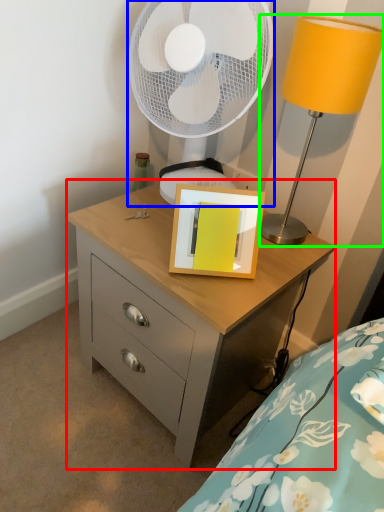
Question: Which object is positioned closest to chest of drawers (highlighted by a red box)? Select from mechanical fan (highlighted by a blue box) and table lamp (highlighted by a green box).

Choices:
 (A) mechanical fan
 (B) table lamp

Answer: (B)